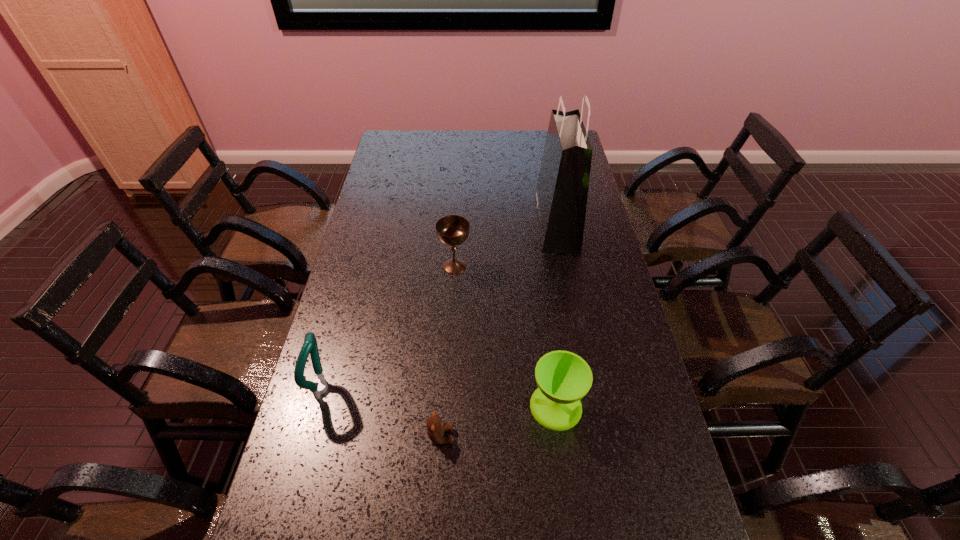
Locate an element on the screen. Image resolution: width=960 pixels, height=540 pixels. vacant region between the chalice and the leftmost object is located at coordinates (389, 327).

At what (x,y) coordinates should I click in order to perform the action: click on unoccupied area between the chalice and the teddy bear. Please return your answer as a coordinate pair (x, y). Looking at the image, I should click on (447, 351).

At what (x,y) coordinates should I click in order to perform the action: click on unoccupied position between the teddy bear and the bottle opener. Please return your answer as a coordinate pair (x, y). The height and width of the screenshot is (540, 960). Looking at the image, I should click on (382, 412).

At what (x,y) coordinates should I click in order to perform the action: click on blank region between the farthest object and the chalice. Please return your answer as a coordinate pair (x, y). Looking at the image, I should click on (506, 245).

At what (x,y) coordinates should I click in order to perform the action: click on vacant region between the shortest object and the wineglass. Please return your answer as a coordinate pair (x, y). Looking at the image, I should click on (498, 421).

Locate an element on the screen. The height and width of the screenshot is (540, 960). free space that is in between the shortest object and the wineglass is located at coordinates point(498,421).

You are a GUI agent. You are given a task and a screenshot of the screen. Output one action in this format:
    pyautogui.click(x=<x>, y=<y>)
    Task: Click on the free spot between the fourth shortest object and the teddy bear
    
    Given the screenshot: What is the action you would take?
    pyautogui.click(x=382, y=412)

Where is `free point between the shopping bag and the second shortest object`? free point between the shopping bag and the second shortest object is located at coordinates (556, 315).

Where is `vacant area between the shortest object and the shopping bag`? This screenshot has width=960, height=540. vacant area between the shortest object and the shopping bag is located at coordinates (498, 330).

The image size is (960, 540). Find the location of `vacant space in between the tallest object and the bottle opener`. vacant space in between the tallest object and the bottle opener is located at coordinates (440, 306).